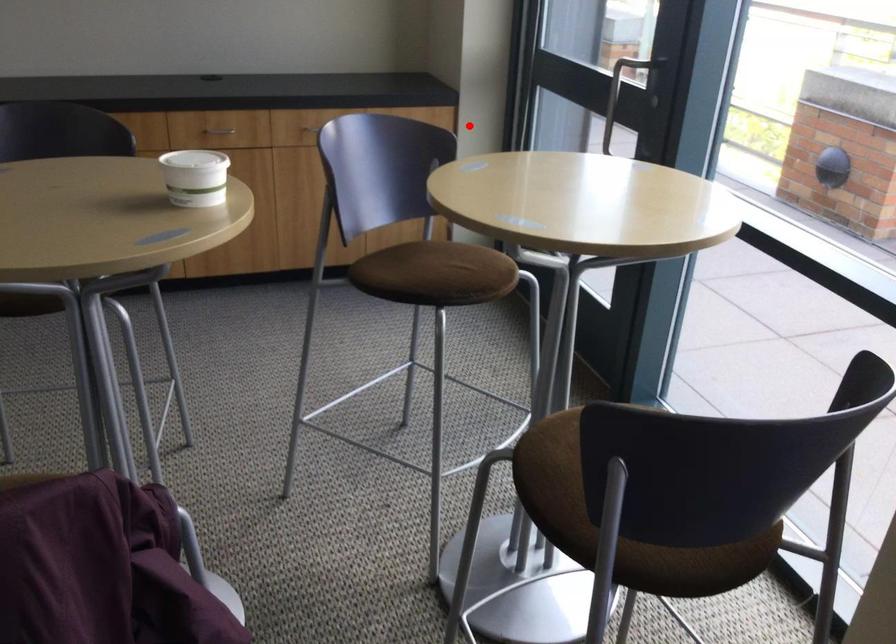
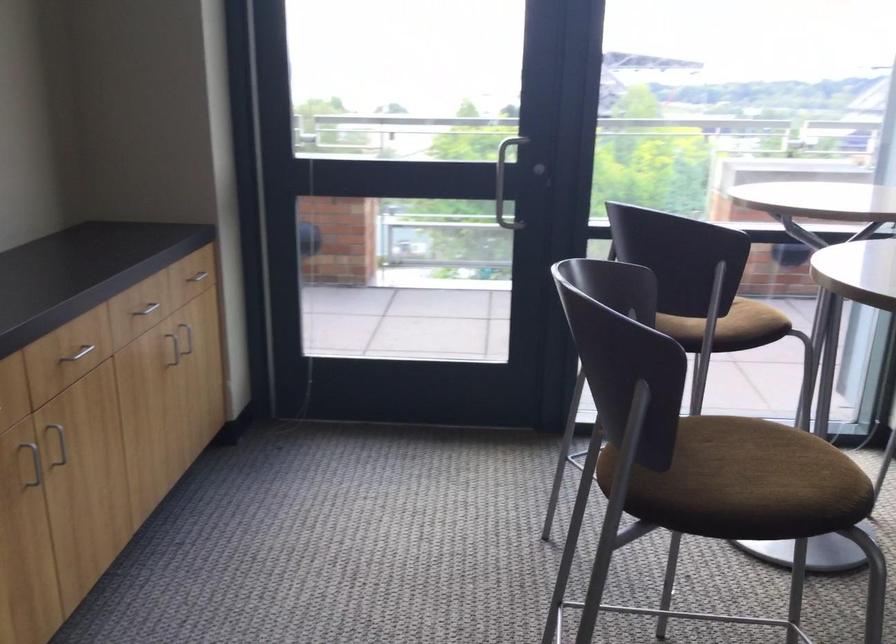
Question: I am providing you with two images of the same scene from different viewpoints. A red point is shown in image1. For the corresponding object point in image2, is it positioned nearer or farther from the camera?

Choices:
 (A) Nearer
 (B) Farther

Answer: (A)